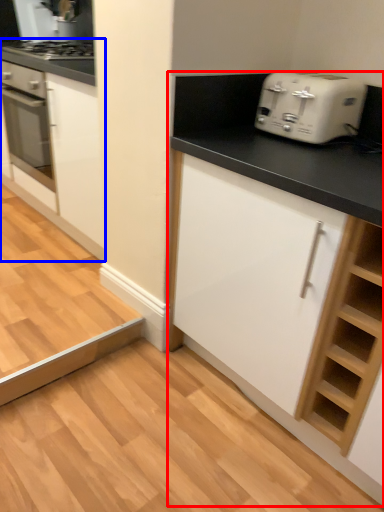
Question: Which object appears farthest to the camera in this image, cabinetry (highlighted by a red box) or cabinetry (highlighted by a blue box)?

Choices:
 (A) cabinetry
 (B) cabinetry

Answer: (B)